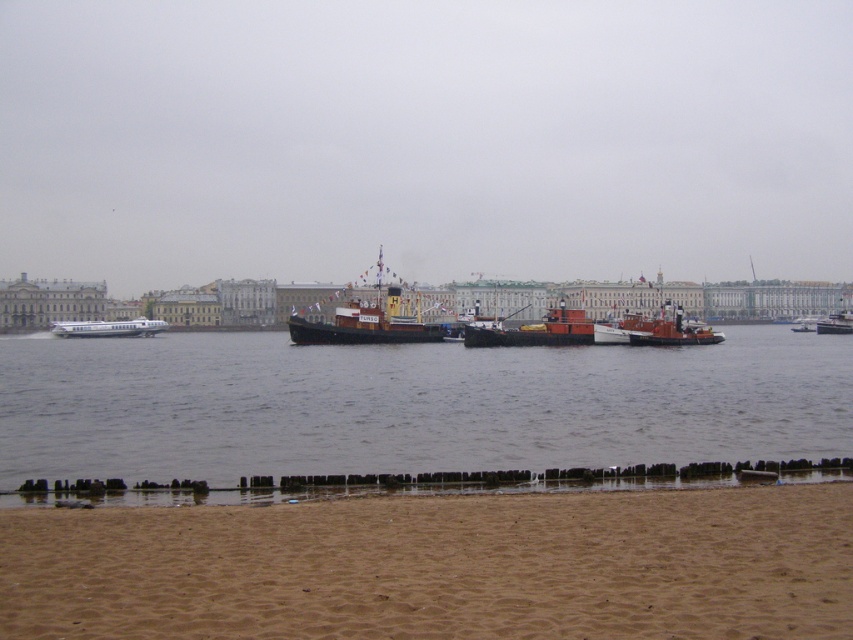
Question: Which of the following is the closest to the observer?

Choices:
 (A) (138, 324)
 (B) (380, 316)
 (C) (651, 330)
 (D) (15, 529)

Answer: (D)

Question: Which of the following is the farthest from the observer?

Choices:
 (A) (103, 323)
 (B) (845, 314)

Answer: (A)

Question: Where is brown sandy beach at lower center located in relation to metallic gray boat at center in the image?

Choices:
 (A) below
 (B) above

Answer: (A)

Question: Is brown wooden water at lower center above metallic red boat at center?

Choices:
 (A) yes
 (B) no

Answer: (B)

Question: Which object appears closest to the camera in this image?

Choices:
 (A) metallic gray boat at center
 (B) wooden ship at center

Answer: (B)

Question: Where is brown wooden water at lower center located in relation to wooden ship at center in the image?

Choices:
 (A) right
 (B) left

Answer: (A)